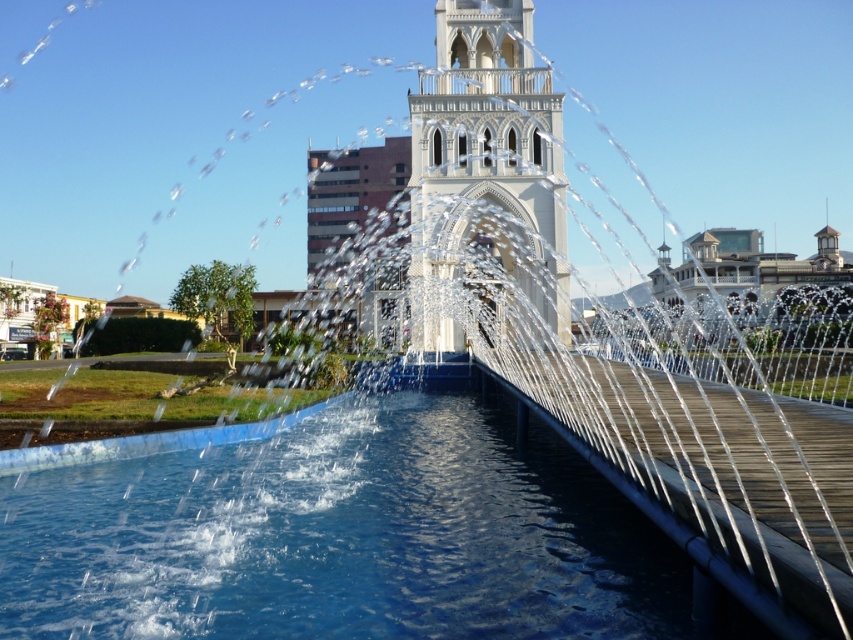
You are standing at the edge of the pool and want to take a photo of both the transparent blue water at center and the white stone tower at center. Which object will appear taller in the photo?

The white stone tower at center will appear taller in the photo because it has a greater height than the transparent blue water at center according to the description.

You are standing at the point with coordinates point (525, 218) and want to walk towards the point with coordinates point (387, 484). Will you be moving towards the fountain or away from it?

Since point (387, 484) is in front of point (525, 218), moving towards point (387, 484) would mean moving towards the fountain.

You are standing in front of the fountain and want to see both the transparent blue water at center and the white stone tower at center. Which one is closer to your eyes?

The transparent blue water at center is below the white stone tower at center, so the white stone tower at center is closer to your eyes.